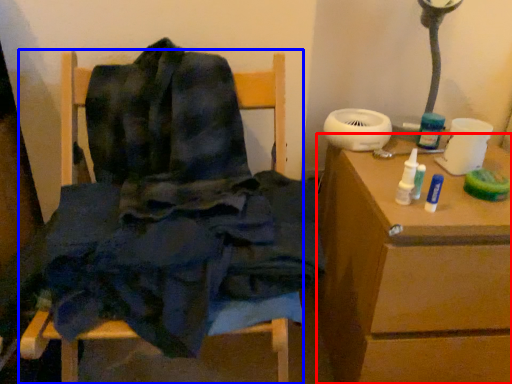
Question: Which object appears closest to the camera in this image, table (highlighted by a red box) or furniture (highlighted by a blue box)?

Choices:
 (A) table
 (B) furniture

Answer: (B)